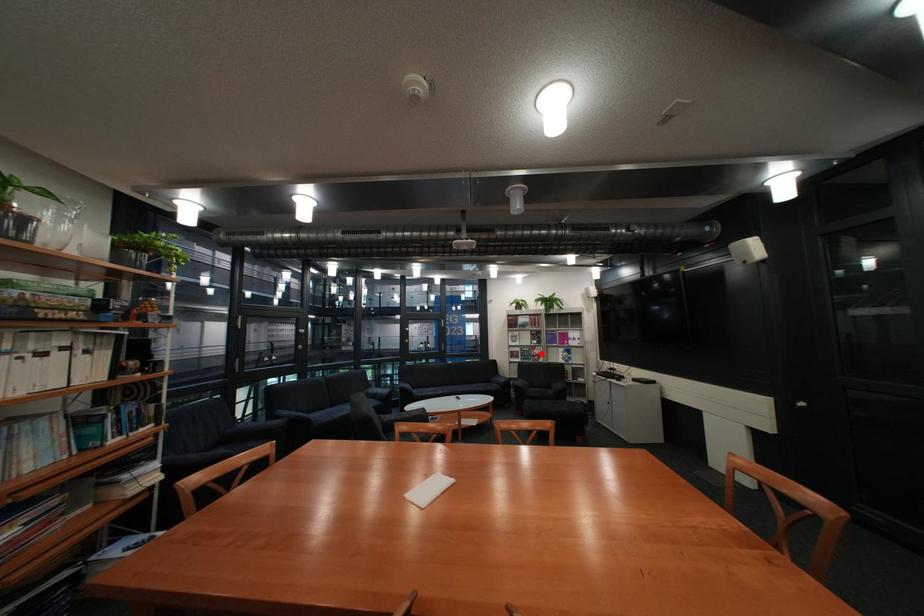
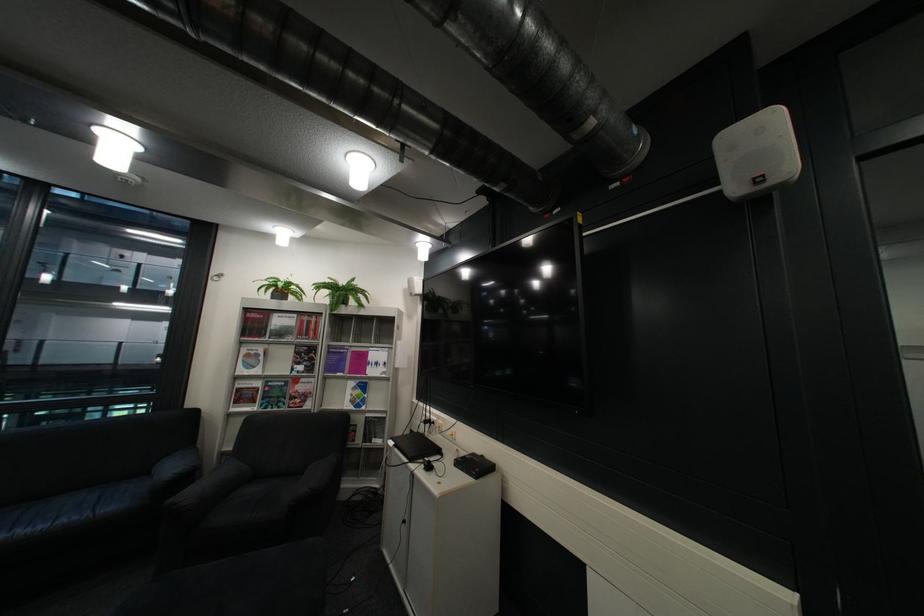
In the second image, find the point that corresponds to the highlighted location in the first image.

(290, 394)